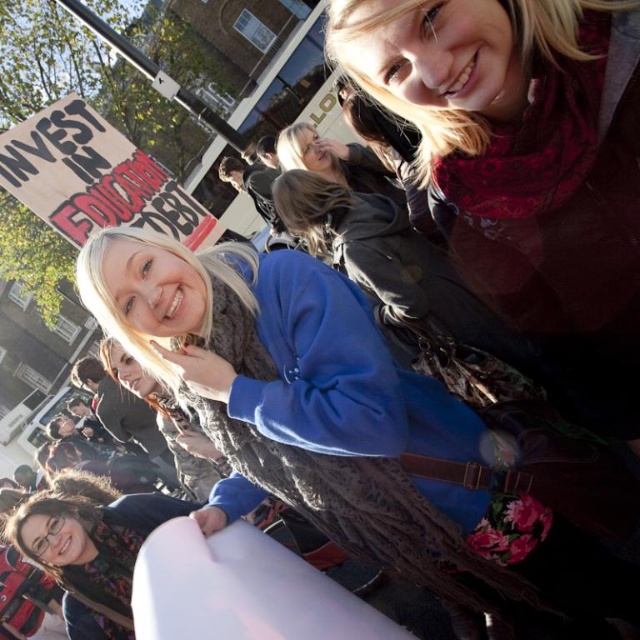
You are a photographer trying to capture a closeup of the blue fleece sweater at center and the matte red scarf at upper right. Given their sizes, which one would require you to move closer to get a detailed shot?

The blue fleece sweater at center has a lesser width compared to the matte red scarf at upper right, so you would need to move closer to the blue fleece sweater at center to capture its details.

You are a photographer standing at the center of the scene. You want to take a photo of the blue fleece sweater at center and the matte red scarf at upper right in the same frame. Can you fit both objects in your camera view without moving your position?

The distance between the blue fleece sweater at center and the matte red scarf at upper right is 9.39 feet. Since the photographer is at the center, the red scarf is 9.39 feet away from the sweater. Depending on the camera lens, it might be possible to capture both in the same frame without moving, but the exact feasibility depends on the lens focal length and field of view.

You are a photographer trying to capture a photo of the matte red scarf at upper right without the blue fleece sweater at center blocking it. What should you do?

Move the camera to the left so that the blue fleece sweater at center is no longer blocking the matte red scarf at upper right.